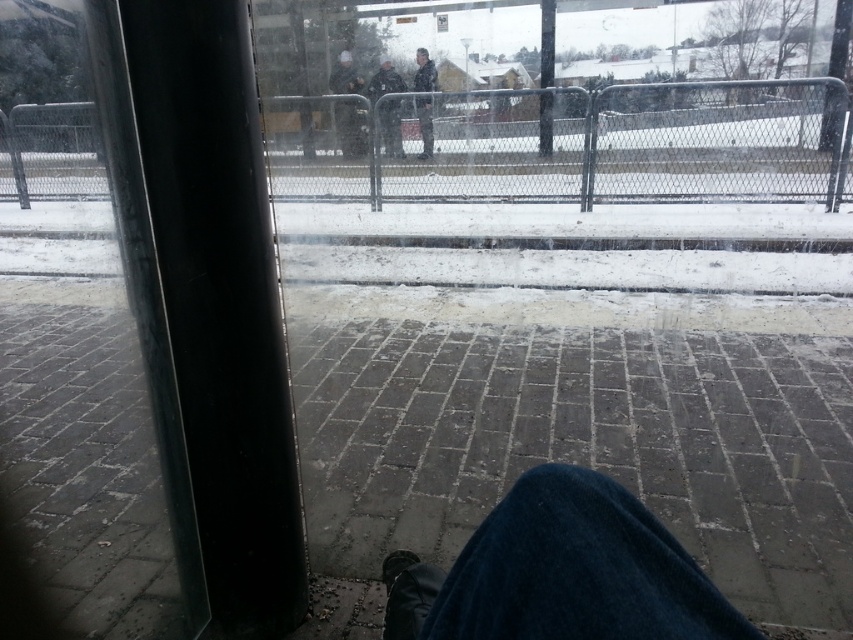
You are a delivery person trying to determine if you can safely step onto the gray concrete pavement at center from the dark gray jacket at center. Based on their relative heights, can you step directly from the jacket to the pavement without needing a ladder?

The gray concrete pavement at center is taller than the dark gray jacket at center, so stepping directly from the jacket to the pavement would require a ladder or some form of elevation since the pavement is higher up.

You are a person sitting near the window in the image. You notice two items labeled as the dark gray uniform at center and the dark gray jacket at center. Which item is closer to the window?

The dark gray uniform at center is positioned under the dark gray jacket at center, so the dark gray jacket at center is closer to the window.

You are a delivery person trying to determine if your 1.5 meter wide delivery cart can fit between the gray concrete pavement at center and the dark gray uniform at center. Can it fit?

The gray concrete pavement at center is larger in size than the dark gray uniform at center, but the description does not provide specific measurements of the space between them. Therefore, it is uncertain whether the 1.5 meter wide delivery cart can fit between them.